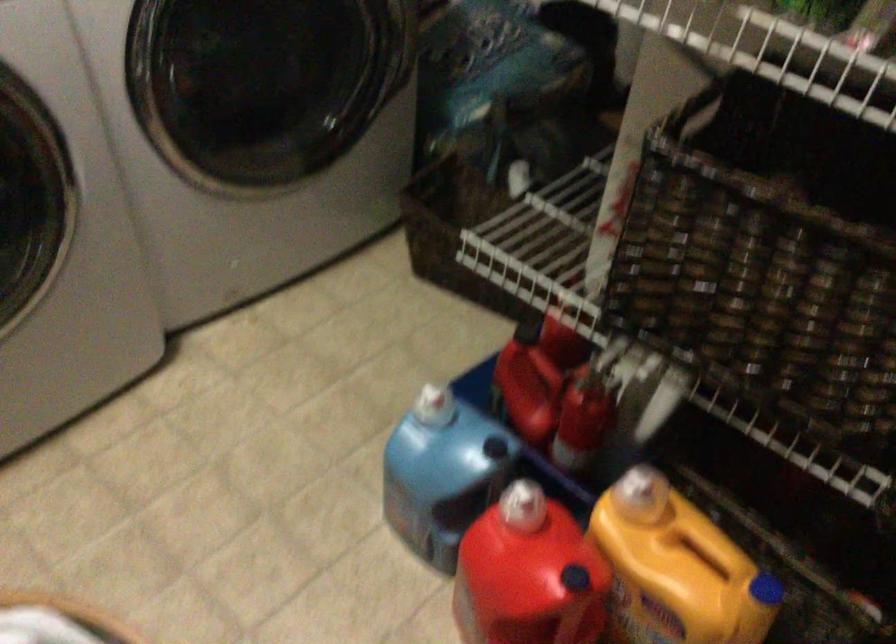
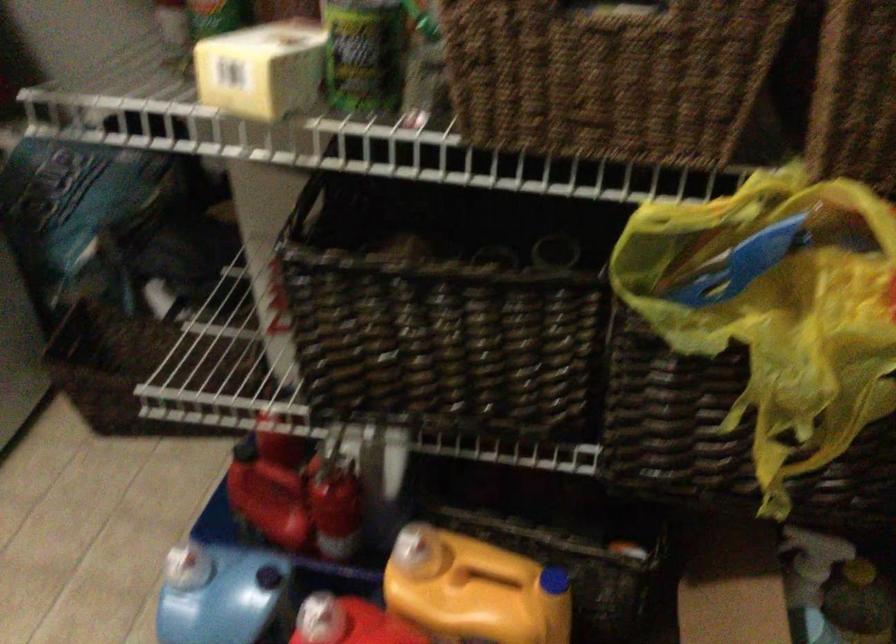
In the second image, find the point that corresponds to point 634,491 in the first image.

(409, 550)